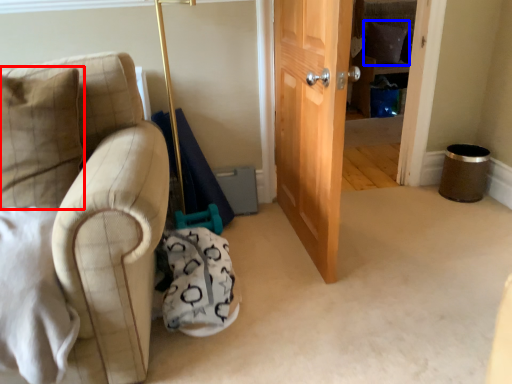
Question: Which point is further to the camera, pillow (highlighted by a red box) or pillow (highlighted by a blue box)?

Choices:
 (A) pillow
 (B) pillow

Answer: (B)